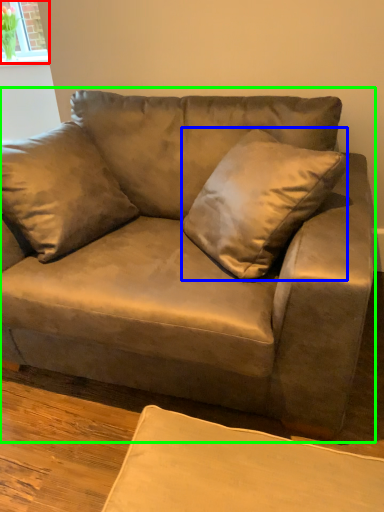
Question: Estimate the real-world distances between objects in this image. Which object is farther from window (highlighted by a red box), throw pillow (highlighted by a blue box) or studio couch (highlighted by a green box)?

Choices:
 (A) throw pillow
 (B) studio couch

Answer: (A)